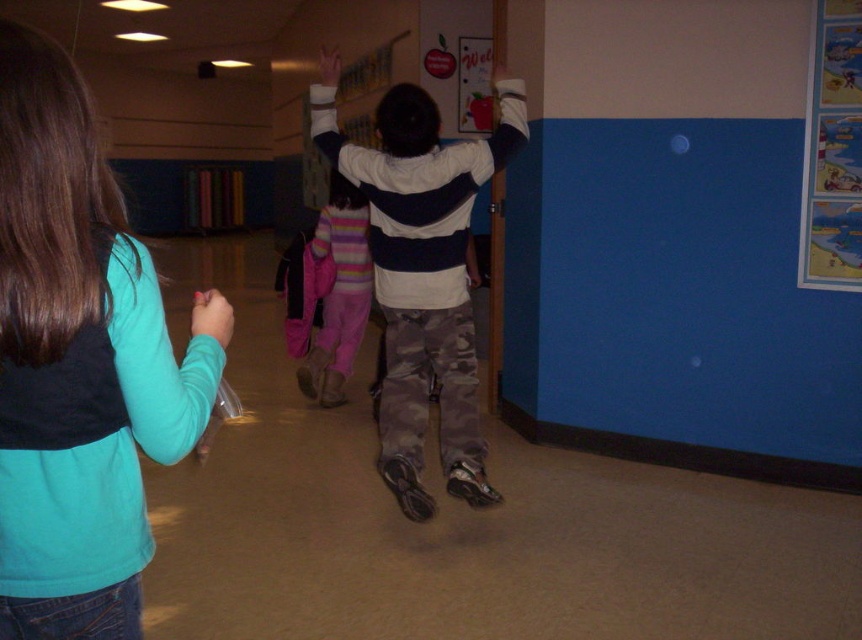
Question: Which point is farther to the camera?

Choices:
 (A) teal fabric shirt at left
 (B) camouflage pants at center
 (C) cartoon-themed posters at right
 (D) striped sweater at center

Answer: (D)

Question: Is cartoon-themed posters at right further to the viewer compared to striped sweater at center?

Choices:
 (A) yes
 (B) no

Answer: (B)

Question: Is teal fabric shirt at left behind cartoon-themed posters at right?

Choices:
 (A) yes
 (B) no

Answer: (B)

Question: Among these points, which one is nearest to the camera?

Choices:
 (A) (173, 355)
 (B) (810, 236)
 (C) (426, 140)
 (D) (345, 224)

Answer: (A)

Question: Among these points, which one is nearest to the camera?

Choices:
 (A) (304, 362)
 (B) (431, 349)
 (C) (167, 349)

Answer: (C)

Question: Is teal fabric shirt at left thinner than camouflage pants at center?

Choices:
 (A) no
 (B) yes

Answer: (B)